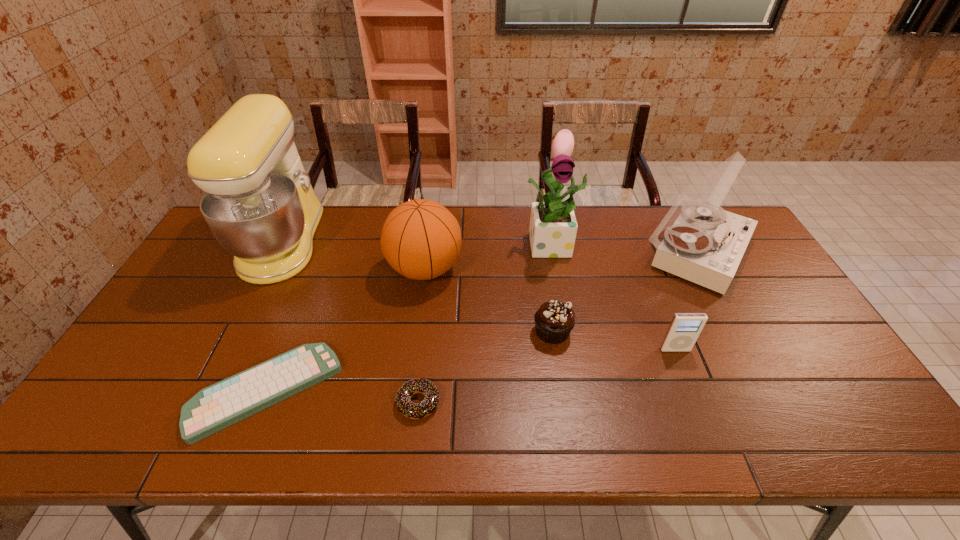
You are a GUI agent. You are given a task and a screenshot of the screen. Output one action in this format:
    pyautogui.click(x=<x>, y=<y>)
    Task: Click on the vacant point located on the left of the sixth shortest object
    This screenshot has width=960, height=540.
    Given the screenshot: What is the action you would take?
    pyautogui.click(x=620, y=251)

In order to click on vacant space located 0.070m on the front of the basketball in this screenshot , I will do `click(420, 314)`.

Where is `free space located 0.100m on the front-facing side of the iPod`? This screenshot has height=540, width=960. free space located 0.100m on the front-facing side of the iPod is located at coordinates (689, 386).

Locate an element on the screen. The width and height of the screenshot is (960, 540). vacant space located 0.160m on the front of the cupcake is located at coordinates (563, 402).

Where is `vacant space located 0.370m on the right of the second shortest object`? The height and width of the screenshot is (540, 960). vacant space located 0.370m on the right of the second shortest object is located at coordinates (595, 402).

You are a GUI agent. You are given a task and a screenshot of the screen. Output one action in this format:
    pyautogui.click(x=<x>, y=<y>)
    Task: Click on the vacant area located 0.380m on the back of the shortest object
    
    Given the screenshot: What is the action you would take?
    pyautogui.click(x=321, y=253)

The width and height of the screenshot is (960, 540). Find the location of `mixer at the far edge`. mixer at the far edge is located at coordinates (259, 203).

The width and height of the screenshot is (960, 540). I want to click on flower arrangement present at the far edge, so click(553, 227).

This screenshot has height=540, width=960. I want to click on record player present at the far edge, so click(703, 243).

At what (x,y) coordinates should I click in order to perform the action: click on basketball located at the far edge. Please return your answer as a coordinate pair (x, y). Looking at the image, I should click on click(x=421, y=239).